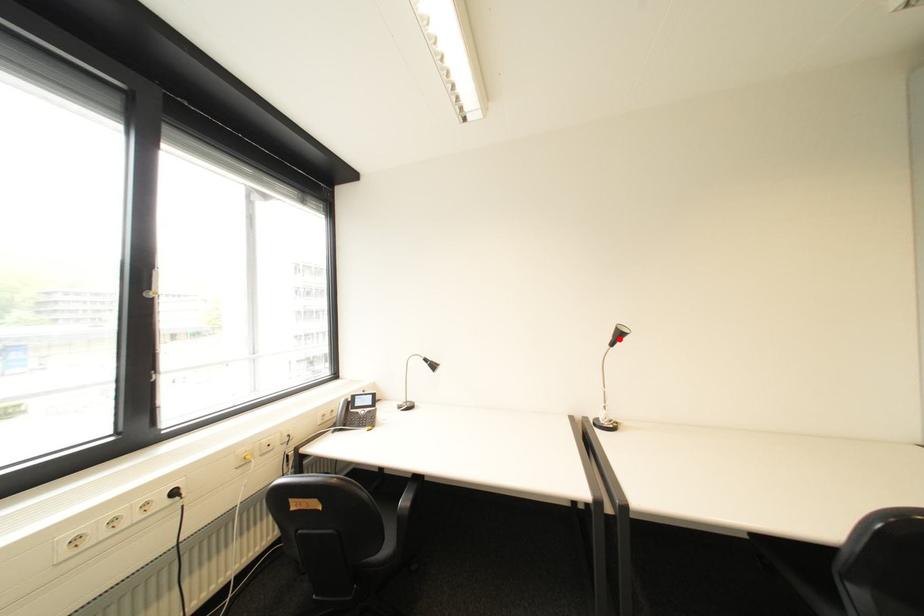
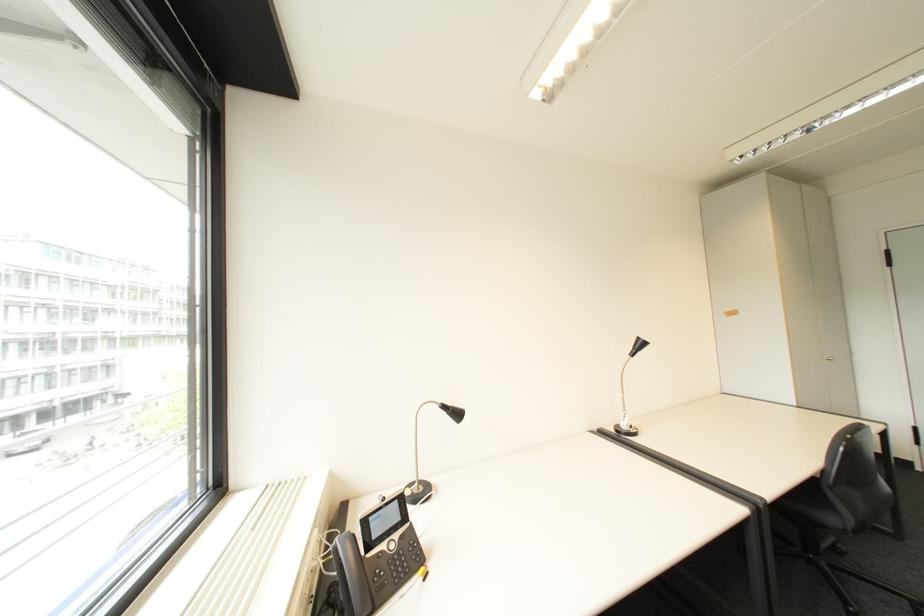
Question: I am providing you with two images of the same scene from different viewpoints. A red point is marked on the first image. Can you still see the location of the red point in image 2?

Choices:
 (A) Yes
 (B) No

Answer: (A)